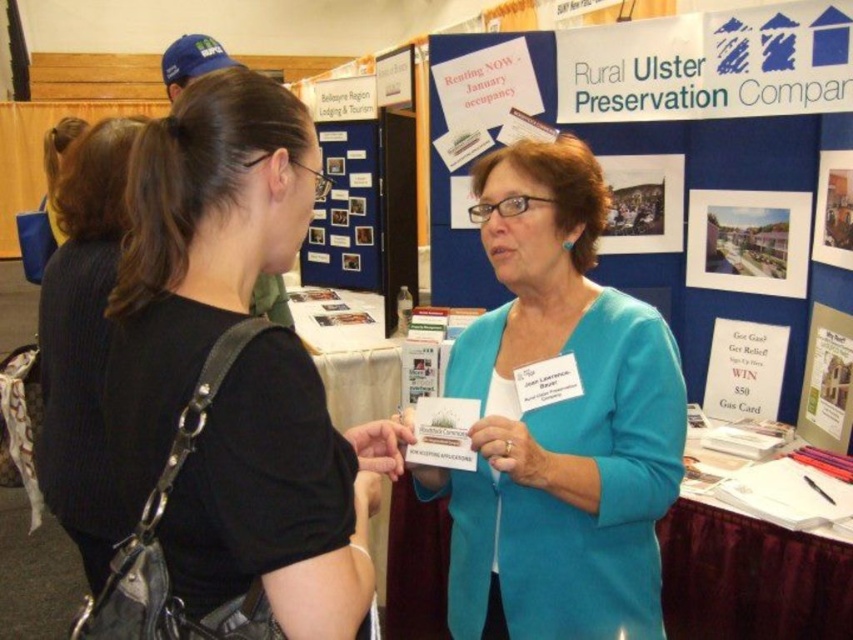
Question: Is blue fabric card at center to the left of blue fabric poster at upper center from the viewer's perspective?

Choices:
 (A) yes
 (B) no

Answer: (B)

Question: Is blue fabric poster at upper center to the left of white paper poster at upper center from the viewer's perspective?

Choices:
 (A) yes
 (B) no

Answer: (A)

Question: Which object appears farthest from the camera in this image?

Choices:
 (A) blue fabric card at center
 (B) matte paper poster at upper right

Answer: (B)

Question: Among these objects, which one is nearest to the camera?

Choices:
 (A) black ribbed sweater at left
 (B) blue fabric poster at upper center

Answer: (A)

Question: Which point appears farthest from the camera in this image?

Choices:
 (A) (775, 339)
 (B) (361, 156)
 (C) (225, 561)
 (D) (403, 60)

Answer: (B)

Question: Can you confirm if black matte shirt at upper left is positioned above white paper poster at upper center?

Choices:
 (A) yes
 (B) no

Answer: (B)